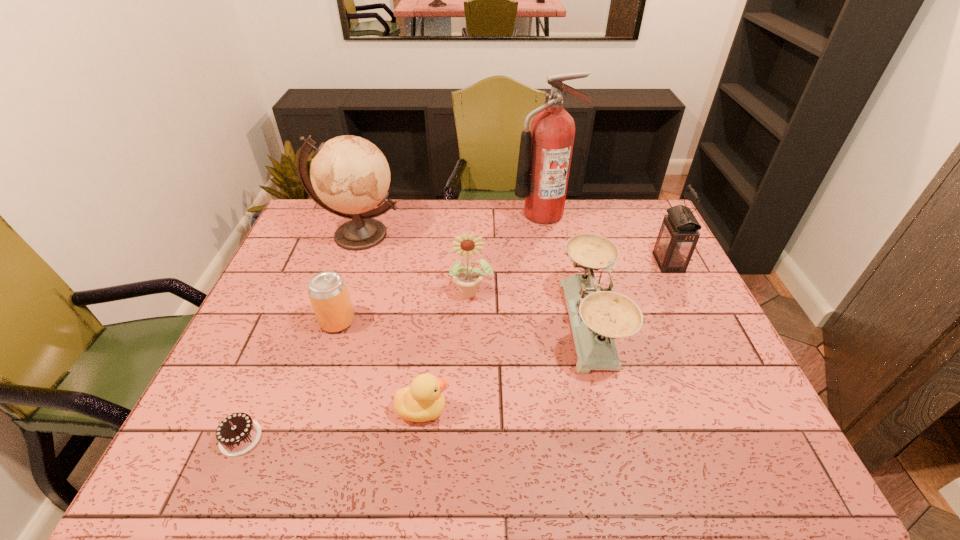
Where is `fire extinguisher that is positioned at the far edge`? fire extinguisher that is positioned at the far edge is located at coordinates (545, 153).

The height and width of the screenshot is (540, 960). What are the coordinates of `globe that is positioned at the far edge` in the screenshot? It's located at (350, 175).

Identify the location of object at the near edge. (237, 434).

Locate an element on the screen. globe located in the left edge section of the desktop is located at coordinates (350, 175).

Locate an element on the screen. The height and width of the screenshot is (540, 960). chocolate cake located in the left edge section of the desktop is located at coordinates (237, 434).

The height and width of the screenshot is (540, 960). I want to click on object that is at the right edge, so click(678, 236).

Locate an element on the screen. object at the far left corner is located at coordinates (350, 175).

Where is `object that is at the near left corner`? The image size is (960, 540). object that is at the near left corner is located at coordinates (237, 434).

You are a GUI agent. You are given a task and a screenshot of the screen. Output one action in this format:
    pyautogui.click(x=<x>, y=<y>)
    Task: Click on the free space at the far edge of the desktop
    The width and height of the screenshot is (960, 540).
    Given the screenshot: What is the action you would take?
    pyautogui.click(x=388, y=213)

I want to click on vacant space at the left edge, so click(276, 348).